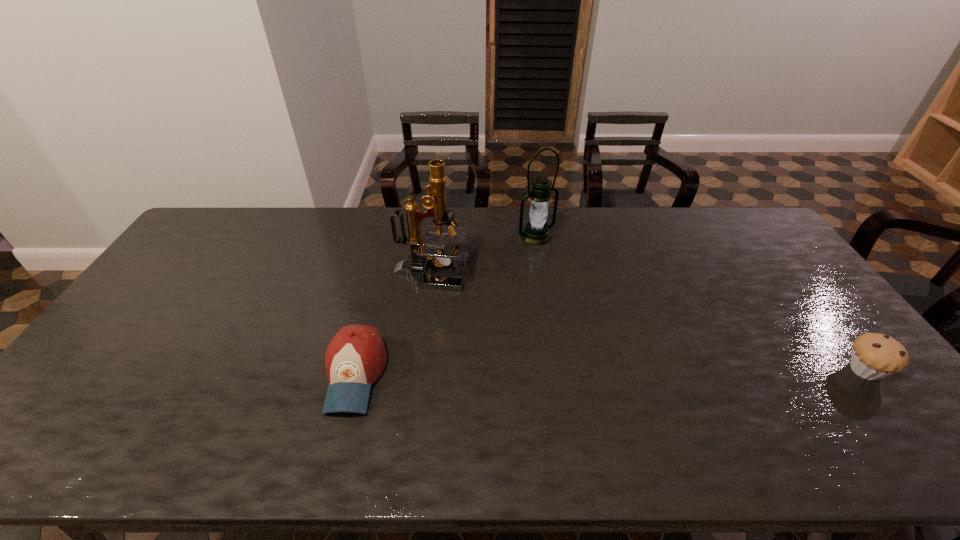
Find the location of a particular element. Image resolution: width=960 pixels, height=540 pixels. vacant space in between the baseball cap and the muffin is located at coordinates (610, 373).

This screenshot has height=540, width=960. Find the location of `free space that is in between the rightmost object and the third shortest object`. free space that is in between the rightmost object and the third shortest object is located at coordinates (701, 303).

The width and height of the screenshot is (960, 540). I want to click on free space between the muffin and the baseball cap, so coord(610,373).

Identify which object is the closest to the lantern. Please provide its 2D coordinates. Your answer should be formatted as a tuple, i.e. [(x, y)], where the tuple contains the x and y coordinates of a point satisfying the conditions above.

[(424, 250)]

Select which object is the second closest to the farthest object. Please provide its 2D coordinates. Your answer should be formatted as a tuple, i.e. [(x, y)], where the tuple contains the x and y coordinates of a point satisfying the conditions above.

[(356, 356)]

The image size is (960, 540). I want to click on vacant area that satisfies the following two spatial constraints: 1. on the front side of the second object from right to left; 2. on the left side of the muffin, so click(x=558, y=370).

Locate an element on the screen. The image size is (960, 540). free location that satisfies the following two spatial constraints: 1. on the front side of the rightmost object; 2. on the right side of the third nearest object is located at coordinates (419, 370).